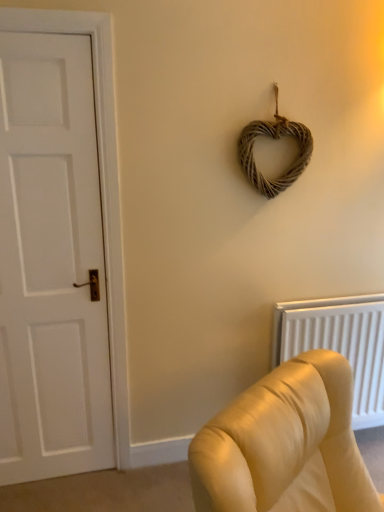
Question: Can you confirm if woven natural heart at upper center is thinner than white textured radiator at lower right?

Choices:
 (A) no
 (B) yes

Answer: (B)

Question: From a real-world perspective, is woven natural heart at upper center over white textured radiator at lower right?

Choices:
 (A) no
 (B) yes

Answer: (B)

Question: Is woven natural heart at upper center not near white textured radiator at lower right?

Choices:
 (A) yes
 (B) no

Answer: (B)

Question: Is woven natural heart at upper center oriented towards white textured radiator at lower right?

Choices:
 (A) yes
 (B) no

Answer: (B)

Question: From the image's perspective, is woven natural heart at upper center beneath white textured radiator at lower right?

Choices:
 (A) no
 (B) yes

Answer: (A)

Question: Considering the relative sizes of woven natural heart at upper center and white textured radiator at lower right in the image provided, is woven natural heart at upper center taller than white textured radiator at lower right?

Choices:
 (A) yes
 (B) no

Answer: (B)

Question: Is woven natural heart at upper center surrounded by white textured radiator at lower right?

Choices:
 (A) yes
 (B) no

Answer: (B)

Question: Is white textured radiator at lower right taller than woven natural heart at upper center?

Choices:
 (A) no
 (B) yes

Answer: (B)

Question: From a real-world perspective, is white textured radiator at lower right under woven natural heart at upper center?

Choices:
 (A) no
 (B) yes

Answer: (B)

Question: Considering the relative positions of white textured radiator at lower right and woven natural heart at upper center in the image provided, is white textured radiator at lower right behind woven natural heart at upper center?

Choices:
 (A) no
 (B) yes

Answer: (B)

Question: Considering the relative sizes of white textured radiator at lower right and woven natural heart at upper center in the image provided, is white textured radiator at lower right bigger than woven natural heart at upper center?

Choices:
 (A) no
 (B) yes

Answer: (B)

Question: Is woven natural heart at upper center at the back of white textured radiator at lower right?

Choices:
 (A) no
 (B) yes

Answer: (A)

Question: Does white matte door at left turn towards woven natural heart at upper center?

Choices:
 (A) yes
 (B) no

Answer: (B)